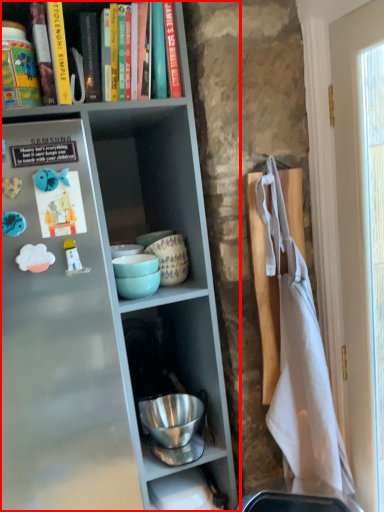
Question: Where is shelf (annotated by the red box) located in relation to book in the image?

Choices:
 (A) left
 (B) right

Answer: (A)